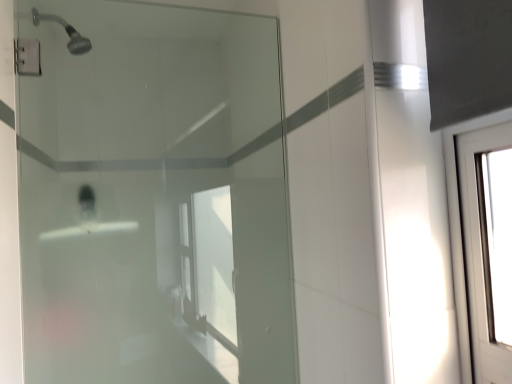
The width and height of the screenshot is (512, 384). What do you see at coordinates (153, 197) in the screenshot?
I see `transparent glass shower door at upper left` at bounding box center [153, 197].

Measure the distance between point (68, 167) and camera.

Point (68, 167) is 3.65 feet away from camera.

Find the location of `transparent glass shower door at upper left`. transparent glass shower door at upper left is located at coordinates click(153, 197).

The height and width of the screenshot is (384, 512). I want to click on transparent glass shower door at upper left, so tap(153, 197).